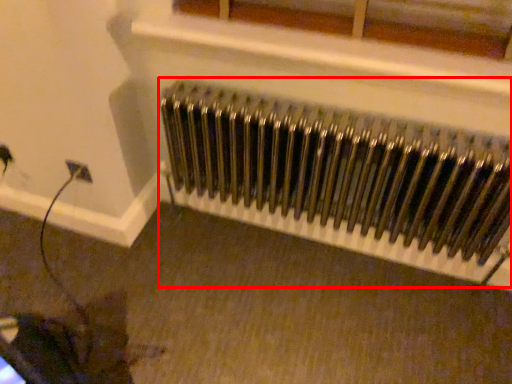
Question: From the image's perspective, where is radiator (annotated by the red box) located in relation to window in the image?

Choices:
 (A) below
 (B) above

Answer: (A)